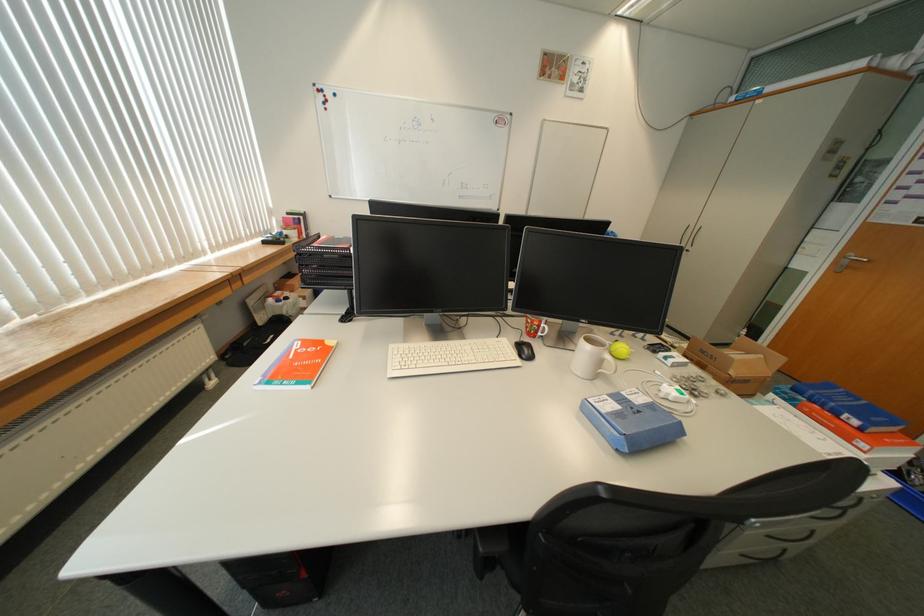
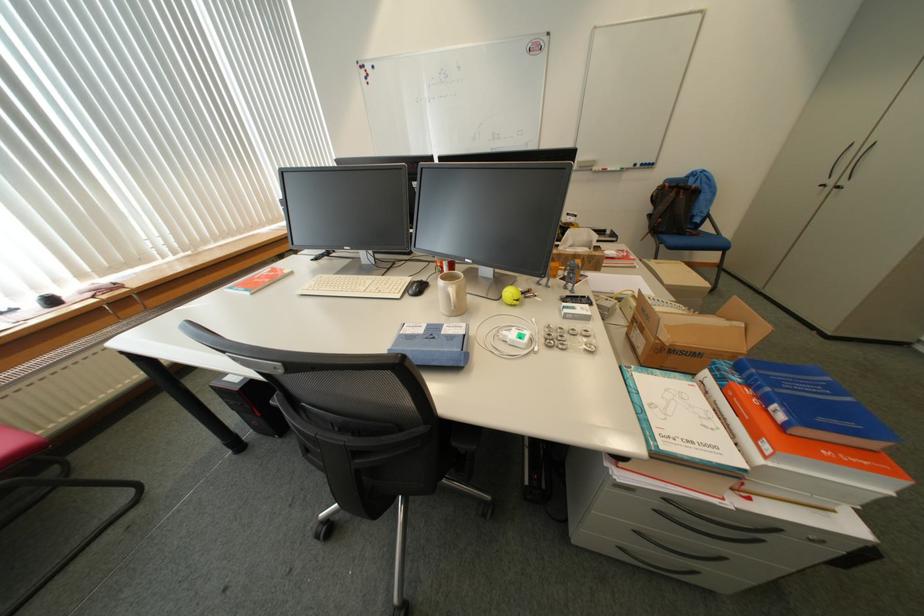
Locate, in the second image, the point that corresponds to (865,424) in the first image.

(791, 418)